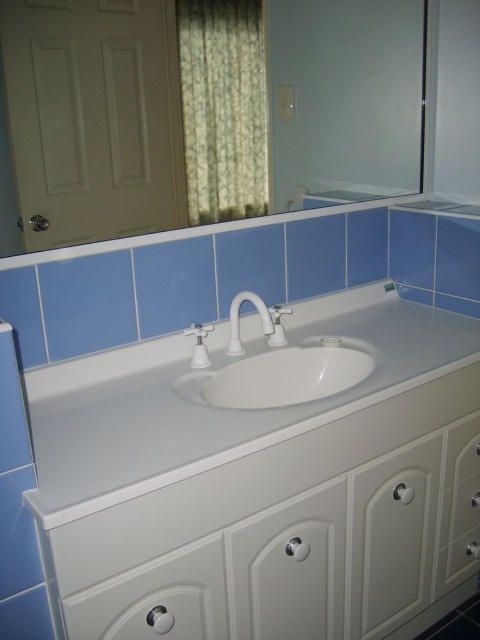
Question: Can you confirm if white glossy sink at center is bigger than white glossy faucet at center?

Choices:
 (A) no
 (B) yes

Answer: (B)

Question: Based on their relative distances, which object is farther from the white glossy countertop at center?

Choices:
 (A) white glossy faucet at center
 (B) white glossy sink at center
 (C) white plastic soap dispenser at center

Answer: (C)

Question: Which point is closer to the camera?

Choices:
 (A) (396, 177)
 (B) (192, 326)
 (C) (212, 113)

Answer: (C)

Question: Which object appears farthest from the camera in this image?

Choices:
 (A) white glossy countertop at center
 (B) clear glass mirror at upper center

Answer: (B)

Question: Does white glossy faucet at center lie behind white plastic soap dispenser at center?

Choices:
 (A) no
 (B) yes

Answer: (A)

Question: Does white glossy drawer at lower center appear on the left side of white glossy sink at center?

Choices:
 (A) yes
 (B) no

Answer: (A)